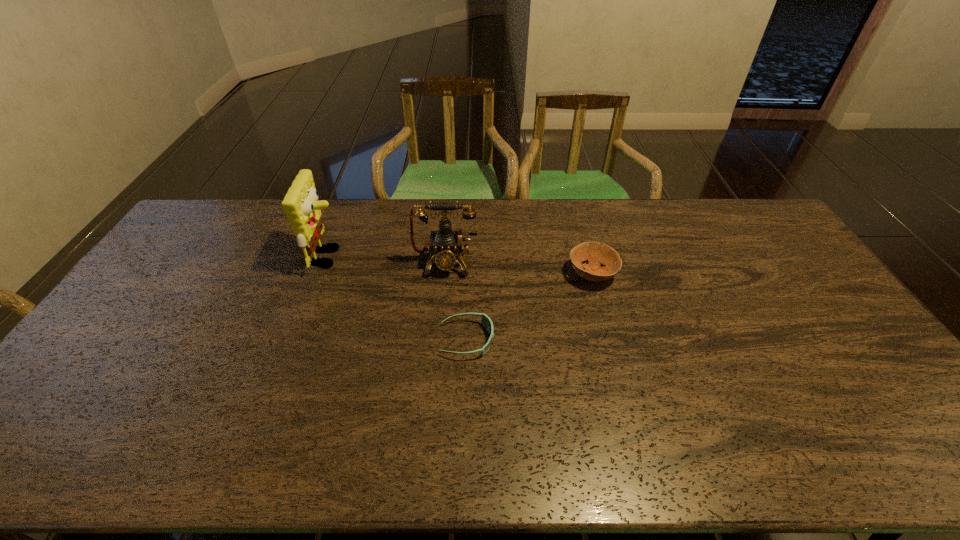
Where is `empty space that is in between the second shortest object and the telephone`? This screenshot has width=960, height=540. empty space that is in between the second shortest object and the telephone is located at coordinates (518, 268).

Identify the location of empty location between the telephone and the goggles. The height and width of the screenshot is (540, 960). coord(456,301).

Identify which object is the second nearest to the second tallest object. Please provide its 2D coordinates. Your answer should be formatted as a tuple, i.e. [(x, y)], where the tuple contains the x and y coordinates of a point satisfying the conditions above.

[(302, 208)]

I want to click on object that is the third closest to the shortest object, so pyautogui.click(x=302, y=208).

You are a GUI agent. You are given a task and a screenshot of the screen. Output one action in this format:
    pyautogui.click(x=<x>, y=<y>)
    Task: Click on the vacant region that satisfies the following two spatial constraints: 1. on the face of the leftmost object; 2. on the back side of the third tallest object
    This screenshot has width=960, height=540.
    Given the screenshot: What is the action you would take?
    pyautogui.click(x=323, y=274)

The height and width of the screenshot is (540, 960). In order to click on vacant space that satisfies the following two spatial constraints: 1. on the front of the third shortest object, featuring the rotary dial; 2. on the right side of the rightmost object in this screenshot , I will do `click(444, 274)`.

You are a GUI agent. You are given a task and a screenshot of the screen. Output one action in this format:
    pyautogui.click(x=<x>, y=<y>)
    Task: Click on the vacant space that satisfies the following two spatial constraints: 1. on the front of the rightmost object, featuring the rotary dial; 2. on the left side of the telephone
    This screenshot has height=540, width=960.
    Given the screenshot: What is the action you would take?
    pyautogui.click(x=444, y=274)